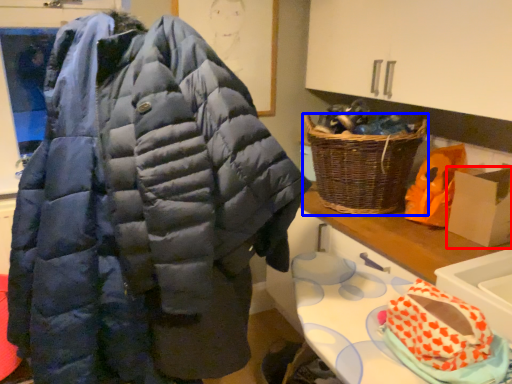
Question: Which of the following is the closest to the observer, cardboard box (highlighted by a red box) or picnic basket (highlighted by a blue box)?

Choices:
 (A) cardboard box
 (B) picnic basket

Answer: (A)